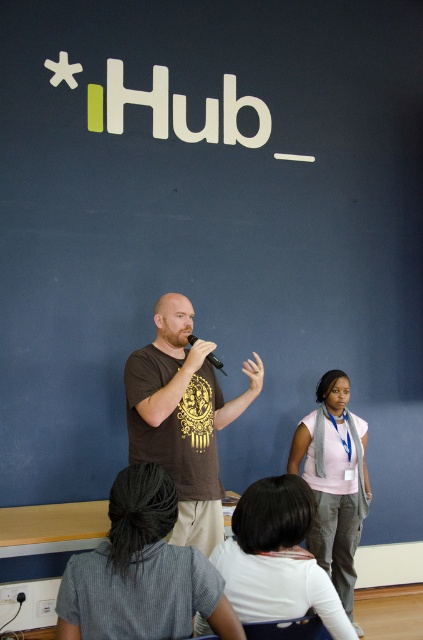
Who is higher up, white matte shirt at lower center or black matte microphone at center?

black matte microphone at center is higher up.

Does white matte shirt at lower center have a lesser height compared to black matte microphone at center?

No.

Where is `white matte shirt at lower center`? white matte shirt at lower center is located at coordinates (277, 557).

Locate an element on the screen. This screenshot has width=423, height=640. brown cotton t-shirt at center is located at coordinates (183, 417).

Does brown cotton t-shirt at center appear under black matte microphone at center?

Correct, brown cotton t-shirt at center is located below black matte microphone at center.

Find the location of a particular element. brown cotton t-shirt at center is located at coordinates (183, 417).

Is pink fabric shirt at center above black matte microphone at center?

No, pink fabric shirt at center is not above black matte microphone at center.

Does point (337, 504) come farther from viewer compared to point (209, 353)?

That is True.

You are a GUI agent. You are given a task and a screenshot of the screen. Output one action in this format:
    pyautogui.click(x=<x>, y=<y>)
    Task: Click on the pink fabric shirt at center
    The height and width of the screenshot is (640, 423).
    Given the screenshot: What is the action you would take?
    pyautogui.click(x=334, y=481)